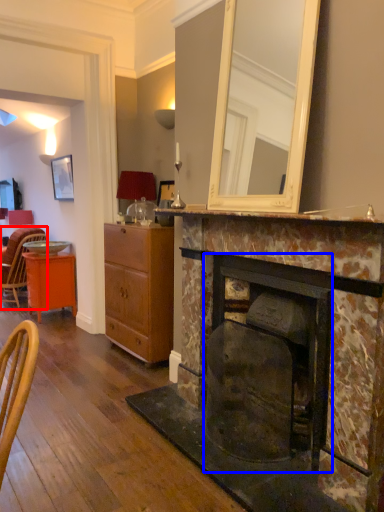
Question: Which point is further to the camera, chair (highlighted by a red box) or fireplace (highlighted by a blue box)?

Choices:
 (A) chair
 (B) fireplace

Answer: (A)